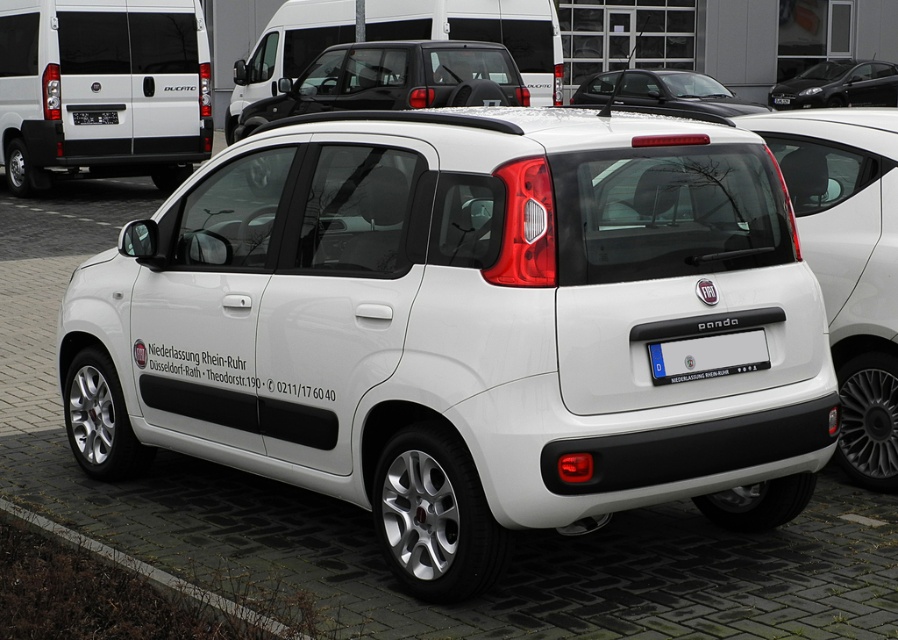
You are a driver trying to read the license plate of the white Fiat Panda parked at the dealership. From your current position, which object is closer to you between the blue metallic license plate at center and the gray concrete curb at lower left?

The gray concrete curb at lower left is closer to you because the blue metallic license plate at center has a smaller size compared to the gray concrete curb at lower left, indicating it is farther away.

You are a driver trying to park your car in a dealership lot. You see the blue metallic license plate at center and the gray concrete curb at lower left. Which object is closer to you from your current position?

The blue metallic license plate at center is positioned over the gray concrete curb at lower left, meaning it is closer to you.

You are a driver approaching the white Fiat Panda parked at an angle. You need to read the license plate number on the blue metallic license plate at center. To do so, which direction should you move relative to the gray concrete curb at lower left?

You should move to the right of the gray concrete curb at lower left to see the blue metallic license plate at center since it is positioned to the right of the curb.